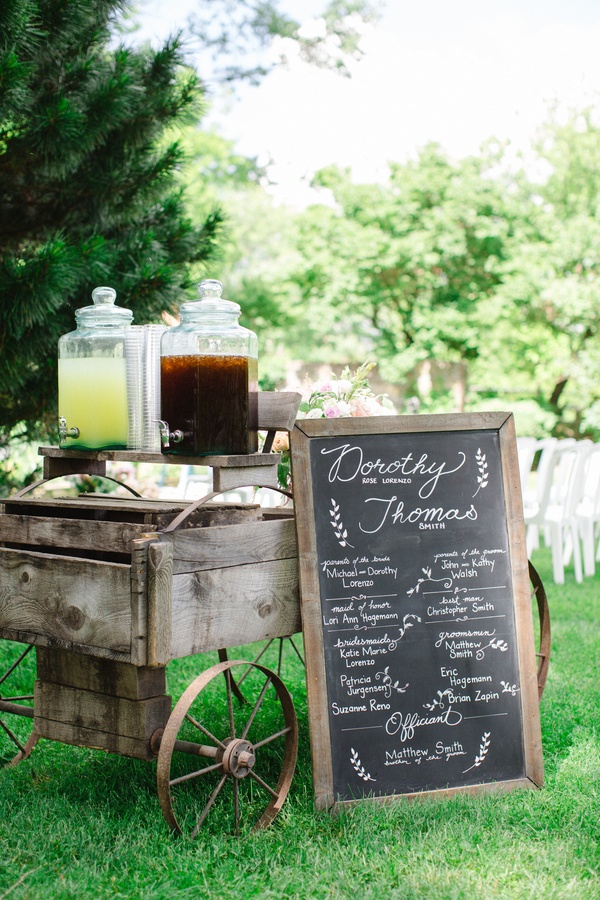
In order to click on seat in this screenshot , I will do `click(129, 456)`.